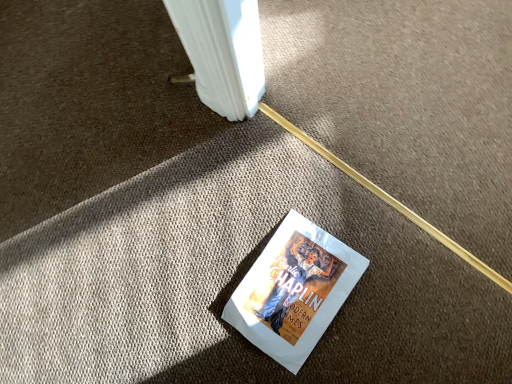
Where is `free space underneath white paper at center (from a real-world perspective)`? Image resolution: width=512 pixels, height=384 pixels. free space underneath white paper at center (from a real-world perspective) is located at coordinates (297, 284).